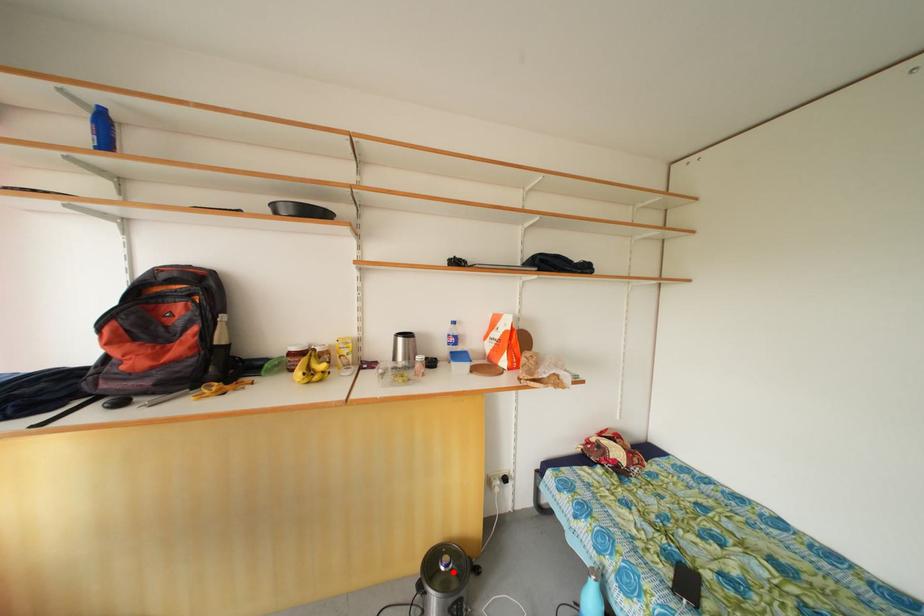
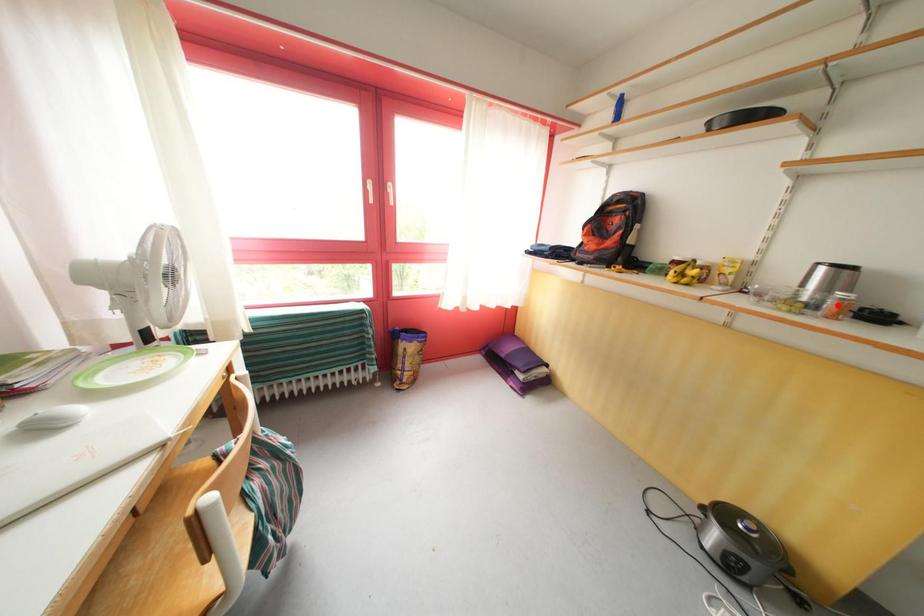
I am providing you with two images of the same scene from different viewpoints. A red point is marked on the first image and another point is marked on the second image. Does the point marked in image1 correspond to the same location as the one in image2?

No